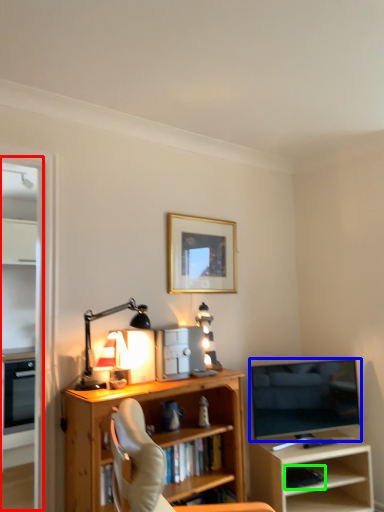
Question: Based on their relative distances, which object is nearer to glass door (highlighted by a red box)? Choose from television (highlighted by a blue box) and book (highlighted by a green box).

Choices:
 (A) television
 (B) book

Answer: (A)